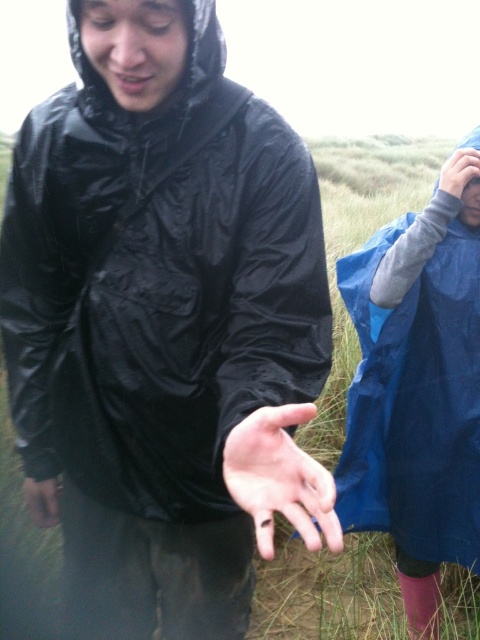
Question: Can you confirm if blue waterproof jacket at right is bigger than matte black hand at lower left?

Choices:
 (A) no
 (B) yes

Answer: (B)

Question: Which object is the farthest from the matte black hand at lower left?

Choices:
 (A) black shiny jacket at center
 (B) blue waterproof jacket at right
 (C) matte blue glove at right
 (D) smooth skin palm at center

Answer: (C)

Question: Is blue waterproof jacket at right in front of matte black hand at lower left?

Choices:
 (A) no
 (B) yes

Answer: (A)

Question: Does black shiny jacket at center have a greater width compared to smooth skin palm at center?

Choices:
 (A) no
 (B) yes

Answer: (B)

Question: Which is farther from the matte black hand at lower left?

Choices:
 (A) smooth skin palm at center
 (B) black shiny jacket at center
 (C) blue waterproof jacket at right
 (D) matte blue glove at right

Answer: (D)

Question: Based on their relative distances, which object is farther from the smooth skin palm at center?

Choices:
 (A) black shiny jacket at center
 (B) matte blue glove at right
 (C) matte black hand at lower left
 (D) blue waterproof jacket at right

Answer: (B)